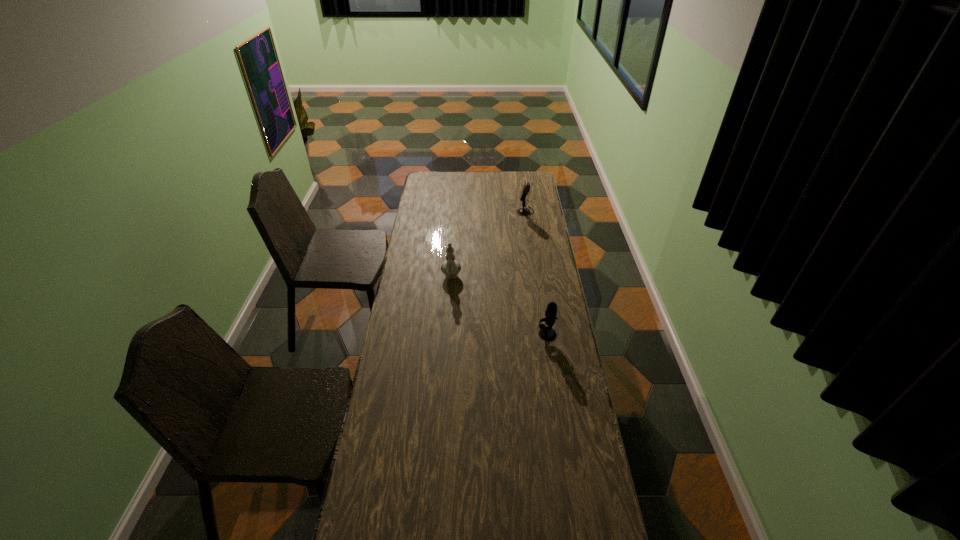
The width and height of the screenshot is (960, 540). Identify the location of free space that satisfies the following two spatial constraints: 1. on the front-facing side of the nearer microphone; 2. on the right side of the farthest object. (542, 334).

At what (x,y) coordinates should I click in order to perform the action: click on free space that satisfies the following two spatial constraints: 1. on the front-facing side of the farthest object; 2. on the left side of the nearest object. Please return your answer as a coordinate pair (x, y). The width and height of the screenshot is (960, 540). Looking at the image, I should click on (542, 334).

You are a GUI agent. You are given a task and a screenshot of the screen. Output one action in this format:
    pyautogui.click(x=<x>, y=<y>)
    Task: Click on the vacant space that satisfies the following two spatial constraints: 1. on the back side of the nearest object; 2. on the front-facing side of the farther microphone
    
    Given the screenshot: What is the action you would take?
    pyautogui.click(x=528, y=211)

This screenshot has height=540, width=960. I want to click on free space that satisfies the following two spatial constraints: 1. at the spout of the nearer microphone; 2. on the left side of the chinaware, so click(x=447, y=334).

You are a GUI agent. You are given a task and a screenshot of the screen. Output one action in this format:
    pyautogui.click(x=<x>, y=<y>)
    Task: Click on the free space that satisfies the following two spatial constraints: 1. on the front-facing side of the farthest object; 2. on the right side of the nearer microphone
    This screenshot has width=960, height=540.
    Given the screenshot: What is the action you would take?
    pyautogui.click(x=542, y=334)

Find the location of a particular element. vacant point that satisfies the following two spatial constraints: 1. on the back side of the nearer microphone; 2. on the front-facing side of the farther microphone is located at coordinates (528, 211).

You are a GUI agent. You are given a task and a screenshot of the screen. Output one action in this format:
    pyautogui.click(x=<x>, y=<y>)
    Task: Click on the vacant space that satisfies the following two spatial constraints: 1. on the front-facing side of the farther microphone; 2. on the left side of the nearer microphone
    
    Given the screenshot: What is the action you would take?
    pyautogui.click(x=542, y=334)

Identify the location of vacant space that satisfies the following two spatial constraints: 1. on the front-facing side of the nearest object; 2. on the right side of the farthest object. This screenshot has width=960, height=540. (542, 334).